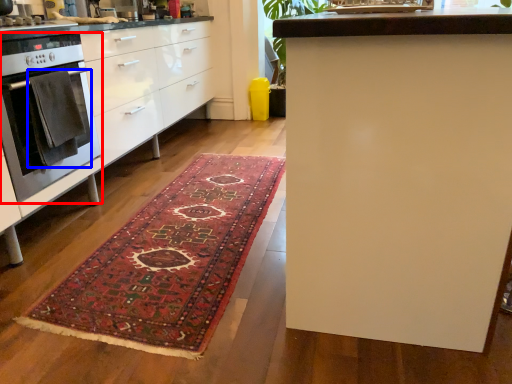
Question: Which object is closer to the camera taking this photo, home appliance (highlighted by a red box) or blanket (highlighted by a blue box)?

Choices:
 (A) home appliance
 (B) blanket

Answer: (A)